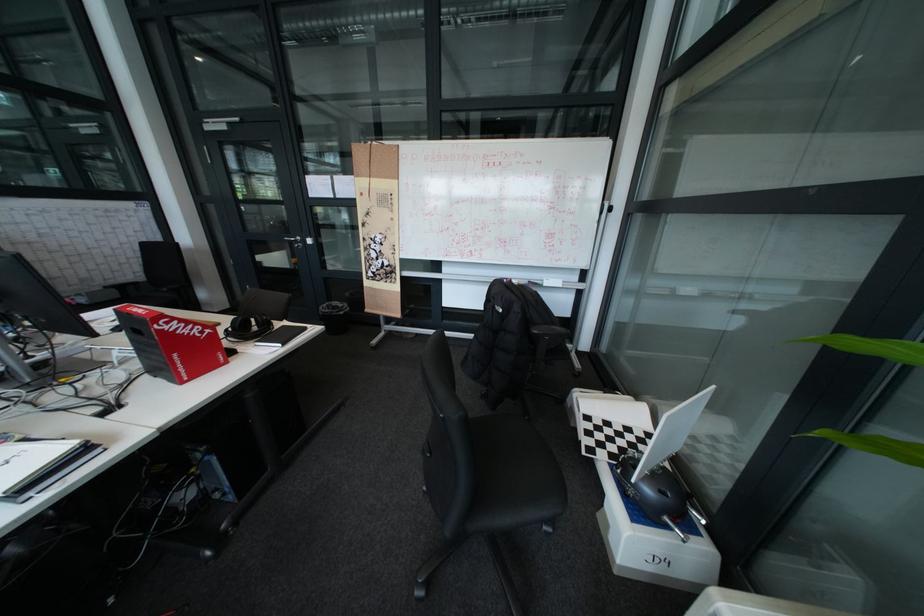
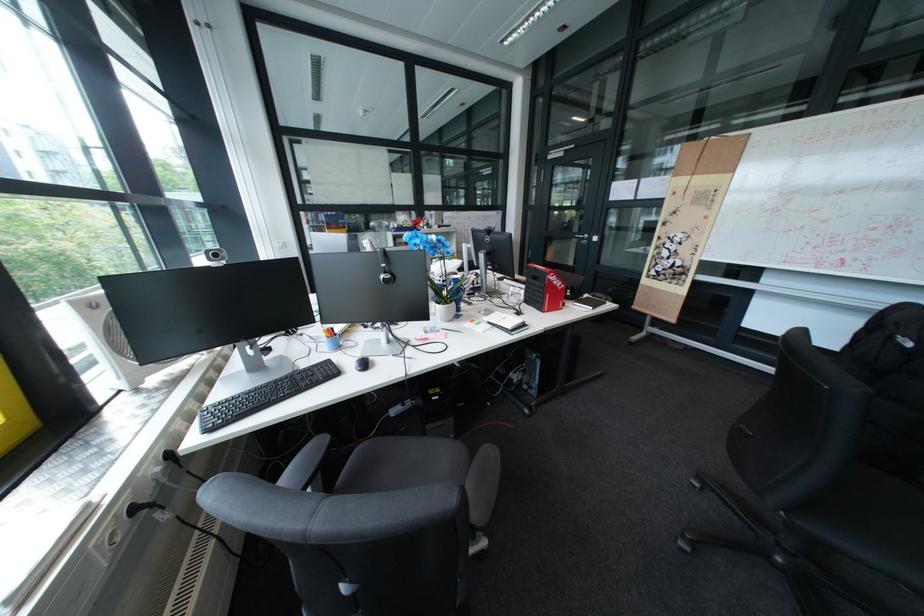
In the second image, find the point that corresponds to pixel 312 246 in the first image.

(598, 243)